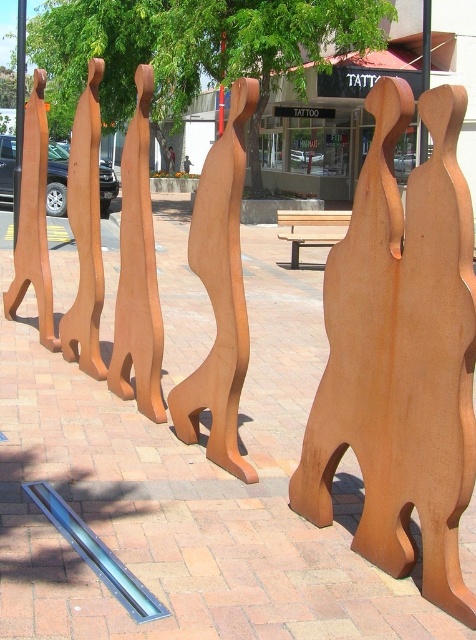
Question: Which of the following is the closest to the observer?

Choices:
 (A) wooden sculpture at center
 (B) rusty metal bench at center
 (C) brown wood sculpture at center
 (D) brown wooden sculpture at center

Answer: (B)

Question: Which of these objects is positioned farthest from the brown wooden sculpture at center?

Choices:
 (A) rusty metal bench at center
 (B) wooden sculpture at center

Answer: (A)

Question: Can you confirm if rusty metal bench at center is positioned above brown wooden sculpture at center?

Choices:
 (A) yes
 (B) no

Answer: (B)

Question: Can you confirm if rusty metal bench at center is positioned to the right of rusty metal sculpture at center?

Choices:
 (A) yes
 (B) no

Answer: (B)

Question: Among these objects, which one is nearest to the camera?

Choices:
 (A) brown wood sculpture at center
 (B) rusty metal bench at center
 (C) rusty metal sculpture at center
 (D) wooden sculpture at center

Answer: (C)

Question: Does rusty metal bench at center have a greater width compared to wooden sculpture at center?

Choices:
 (A) no
 (B) yes

Answer: (B)